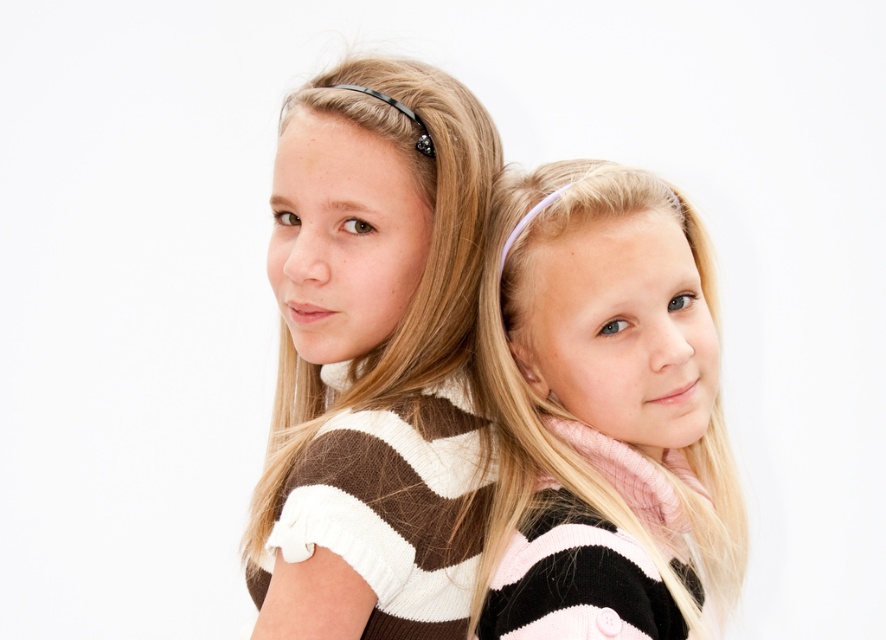
Can you confirm if brown striped sweater at center is positioned below pink striped sweater at center?

No, brown striped sweater at center is not below pink striped sweater at center.

Based on the photo, between brown striped sweater at center and pink striped sweater at center, which one is positioned lower?

Positioned lower is pink striped sweater at center.

The width and height of the screenshot is (886, 640). What do you see at coordinates (372, 356) in the screenshot?
I see `brown striped sweater at center` at bounding box center [372, 356].

You are a GUI agent. You are given a task and a screenshot of the screen. Output one action in this format:
    pyautogui.click(x=<x>, y=<y>)
    Task: Click on the brown striped sweater at center
    This screenshot has height=640, width=886.
    Given the screenshot: What is the action you would take?
    pyautogui.click(x=372, y=356)